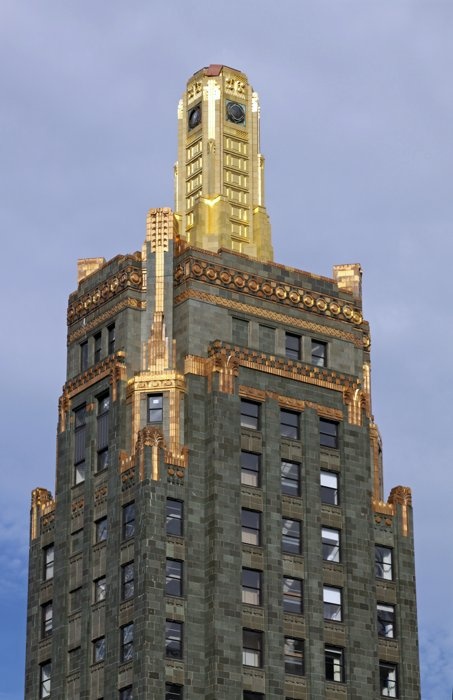
The width and height of the screenshot is (453, 700). In order to click on window in this screenshot , I will do `click(254, 649)`.